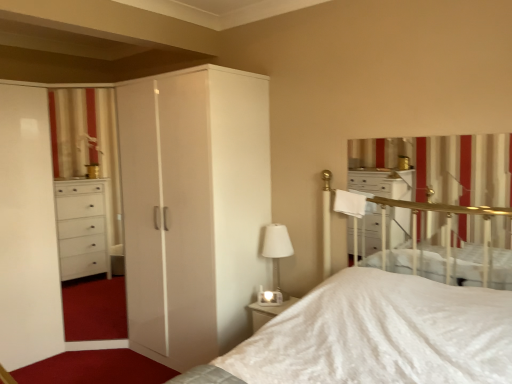
What do you see at coordinates (445, 166) in the screenshot? I see `white striped curtain at upper right` at bounding box center [445, 166].

Measure the distance between white glass table lamp at center and camera.

They are 2.78 meters apart.

Locate an element on the screen. The image size is (512, 384). white striped curtain at upper right is located at coordinates 445,166.

Is point (201, 283) closer or farther from the camera than point (275, 294)?

Clearly, point (201, 283) is closer to the camera than point (275, 294).

Could you tell me if white glossy wardrobe at center is facing white glass table lamp at center?

No, white glossy wardrobe at center is not aimed at white glass table lamp at center.

Does white glossy wardrobe at center contain white glass table lamp at center?

Definitely not — white glass table lamp at center is not inside white glossy wardrobe at center.

Between white glossy wardrobe at center and white glass table lamp at center, which one has less height?

With less height is white glass table lamp at center.

Is white glass table lamp at center taller than white glossy wardrobe at center?

In fact, white glass table lamp at center may be shorter than white glossy wardrobe at center.

Based on the photo, in terms of width, does white glass table lamp at center look wider or thinner when compared to white glossy wardrobe at center?

Clearly, white glass table lamp at center has less width compared to white glossy wardrobe at center.

From the image's perspective, is white glass table lamp at center under white glossy wardrobe at center?

Yes, from the image's perspective, white glass table lamp at center is beneath white glossy wardrobe at center.

Does white glass table lamp at center contain white striped curtain at upper right?

No, white striped curtain at upper right is not a part of white glass table lamp at center.

Is white glass table lamp at center to the right of white striped curtain at upper right from the viewer's perspective?

No, white glass table lamp at center is not to the right of white striped curtain at upper right.

Does white glass table lamp at center have a greater height compared to white striped curtain at upper right?

No, white glass table lamp at center is not taller than white striped curtain at upper right.

Consider the image. Are white striped curtain at upper right and white glass table lamp at center making contact?

white striped curtain at upper right is not next to white glass table lamp at center, and they're not touching.

Is point (373, 166) closer or farther from the camera than point (262, 303)?

Clearly, point (373, 166) is closer to the camera than point (262, 303).

Is white striped curtain at upper right not inside white glass table lamp at center?

Yes, white striped curtain at upper right is outside of white glass table lamp at center.

Is white glossy wardrobe at center turned away from white striped curtain at upper right?

No, white glossy wardrobe at center is not facing away from white striped curtain at upper right.

Is white glossy wardrobe at center inside or outside of white striped curtain at upper right?

white glossy wardrobe at center is outside white striped curtain at upper right.

This screenshot has width=512, height=384. I want to click on curtain lying in front of the white glossy wardrobe at center, so click(445, 166).

Is white glossy wardrobe at center completely or partially inside white striped curtain at upper right?

No, white striped curtain at upper right does not contain white glossy wardrobe at center.

From the image's perspective, would you say white striped curtain at upper right is shown under white glossy wardrobe at center?

No.

Measure the distance from white striped curtain at upper right to white glossy wardrobe at center.

white striped curtain at upper right is 4.02 feet from white glossy wardrobe at center.

Between white striped curtain at upper right and white glossy wardrobe at center, which one has less height?

white striped curtain at upper right is shorter.

The image size is (512, 384). Find the location of `cupboard that appears in front of the white glass table lamp at center`. cupboard that appears in front of the white glass table lamp at center is located at coordinates (193, 209).

You are a GUI agent. You are given a task and a screenshot of the screen. Output one action in this format:
    pyautogui.click(x=<x>, y=<y>)
    Task: Click on the table lamp below the white glossy wardrobe at center (from the image's perspective)
    
    Given the screenshot: What is the action you would take?
    pyautogui.click(x=275, y=259)

Looking at the image, which one is located closer to white striped curtain at upper right, white glass table lamp at center or white glossy wardrobe at center?

white glass table lamp at center.

Based on their spatial positions, is white glossy wardrobe at center or white striped curtain at upper right closer to white glass table lamp at center?

white glossy wardrobe at center lies closer to white glass table lamp at center than the other object.

From the image, which object appears to be farther from white striped curtain at upper right, white glossy wardrobe at center or white glass table lamp at center?

white glossy wardrobe at center.

When comparing their distances from white glossy wardrobe at center, does white glass table lamp at center or white striped curtain at upper right seem closer?

white glass table lamp at center is positioned closer to the anchor white glossy wardrobe at center.

Which object lies further to the anchor point white glossy wardrobe at center, white striped curtain at upper right or white glass table lamp at center?

Among the two, white striped curtain at upper right is located further to white glossy wardrobe at center.

From the image, which object appears to be farther from white glass table lamp at center, white striped curtain at upper right or white glossy wardrobe at center?

white striped curtain at upper right is further to white glass table lamp at center.

I want to click on table lamp situated between white glossy wardrobe at center and white striped curtain at upper right from left to right, so click(275, 259).